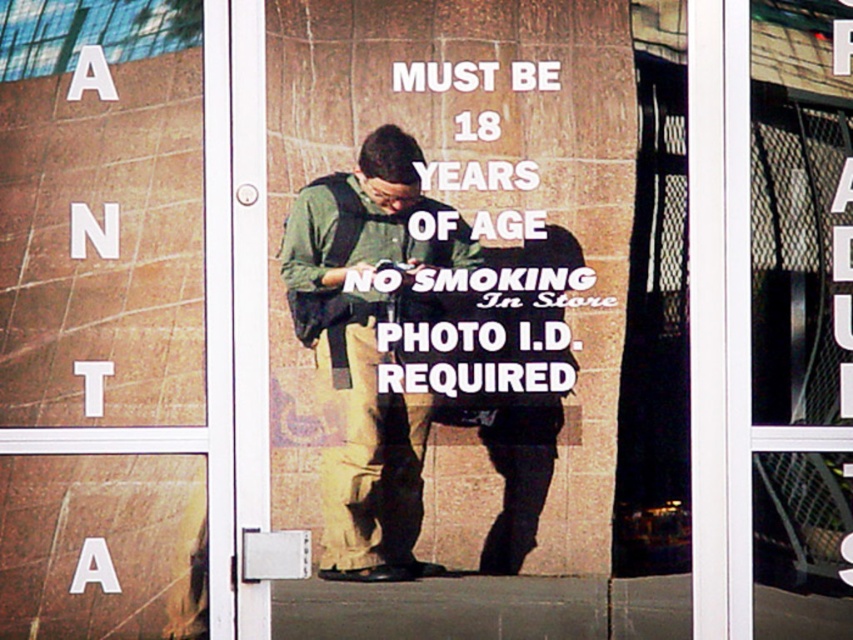
Question: Is matte brown sign at upper left to the right of green fabric backpack at center from the viewer's perspective?

Choices:
 (A) no
 (B) yes

Answer: (A)

Question: Does matte brown sign at upper left appear under green fabric backpack at center?

Choices:
 (A) yes
 (B) no

Answer: (B)

Question: Which point is closer to the camera taking this photo?

Choices:
 (A) (204, 525)
 (B) (397, 412)

Answer: (A)

Question: Can you confirm if matte brown sign at upper left is wider than green fabric backpack at center?

Choices:
 (A) yes
 (B) no

Answer: (A)